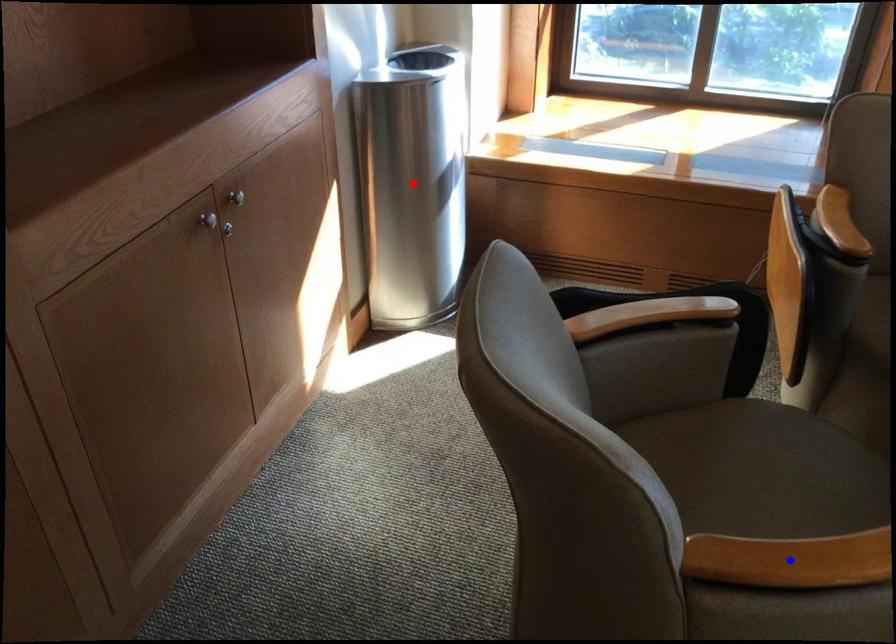
Question: Which of the two points in the image is closer to the camera?

Choices:
 (A) Blue point is closer.
 (B) Red point is closer.

Answer: (A)